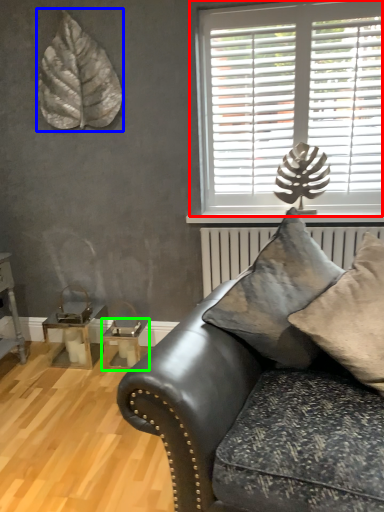
Question: Which object is positioned closest to window (highlighted by a red box)? Select from leaf (highlighted by a blue box) and table (highlighted by a green box).

Choices:
 (A) leaf
 (B) table

Answer: (A)